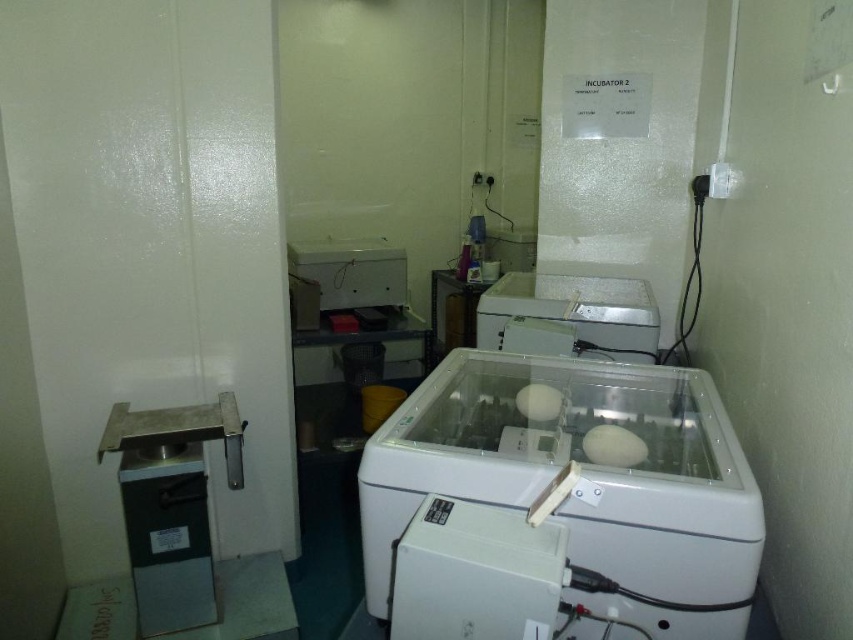
You are a researcher in the lab and need to locate the transparent plastic incubator at center. According to the coordinates provided, where exactly is it located?

The transparent plastic incubator at center is located at point (560, 504).

You are a researcher who needs to place a 12 inch long thermometer between the transparent plastic incubator at center and the white plastic incubator at center. Is there enough space between them to fit the thermometer?

The transparent plastic incubator at center is 27.15 inches from white plastic incubator at center. Since the thermometer is 12 inches long, there is sufficient space between them to place the thermometer.

You are a researcher in the lab and need to place an object that is 30 cm in width. You have two incubators available. Which incubator, the transparent plastic incubator at center or the white plastic incubator at center, can accommodate the object based on their sizes?

The transparent plastic incubator at center is larger in size than the white plastic incubator at center, so the transparent plastic incubator at center can accommodate the object.